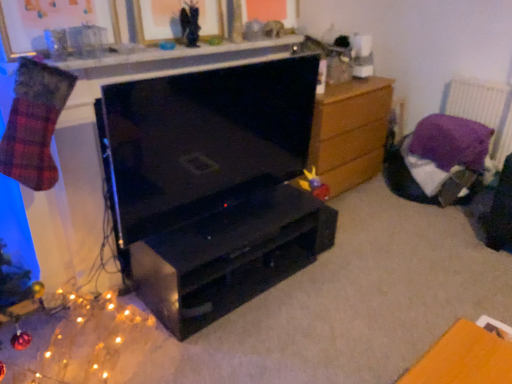
Image resolution: width=512 pixels, height=384 pixels. Identify the location of free spot to the right of glittering gold lights at lower left. pos(198,354).